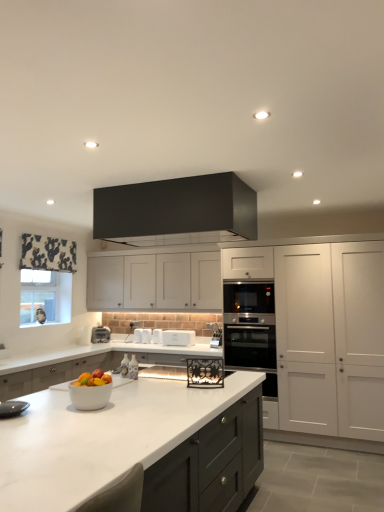
This screenshot has height=512, width=384. What do you see at coordinates (215, 334) in the screenshot? I see `satin black oven at center, which is counted as the fourth appliance, starting from the left` at bounding box center [215, 334].

Describe the element at coordinates (250, 329) in the screenshot. I see `satin silver oven at center, the 1th oven positioned from the bottom` at that location.

Find the location of a particular element. satin silver oven at center, which appears as the second oven when viewed from the top is located at coordinates (250, 329).

What is the approximate width of white plastic toaster at center?

white plastic toaster at center is 11.09 inches in width.

What is the approximate width of white plastic toaster at center, which is the 2th appliance in left-to-right order?

7.11 inches.

Where is `shiny plastic bowl at center`? shiny plastic bowl at center is located at coordinates (93, 379).

Locate an element on the screen. This screenshot has height=512, width=384. satin black oven at center, the 1th appliance in the right-to-left sequence is located at coordinates [x=215, y=334].

Measure the distance from white plastic toaster at center, the 3th appliance when ordered from left to right, to white matte cabinet at center, which ranks as the 3th cabinetry in front-to-back order.

white plastic toaster at center, the 3th appliance when ordered from left to right, and white matte cabinet at center, which ranks as the 3th cabinetry in front-to-back order, are 79.64 centimeters apart from each other.

Based on the photo, from a real-world perspective, which object stands above the other?

white matte cabinet at center, the first cabinetry in the back-to-front sequence, from a real-world perspective.

Looking at this image, is white plastic toaster at center, the 3th appliance when ordered from left to right, placed right next to white matte cabinet at center, which ranks as the 3th cabinetry in front-to-back order?

No, white plastic toaster at center, the 3th appliance when ordered from left to right, is not making contact with white matte cabinet at center, which ranks as the 3th cabinetry in front-to-back order.

Considering the positions of objects white plastic toaster at center, acting as the 2th appliance starting from the right, and white matte cabinet at center, the first cabinetry in the back-to-front sequence, in the image provided, who is more to the right, white plastic toaster at center, acting as the 2th appliance starting from the right, or white matte cabinet at center, the first cabinetry in the back-to-front sequence,?

white plastic toaster at center, acting as the 2th appliance starting from the right.

Considering the sizes of satin black oven at right, which is the 1th oven from top to bottom, and clear glass window screen at left in the image, is satin black oven at right, which is the 1th oven from top to bottom, wider or thinner than clear glass window screen at left?

satin black oven at right, which is the 1th oven from top to bottom, is wider than clear glass window screen at left.

Is satin black oven at right, the 2th oven positioned from the bottom, not within clear glass window screen at left?

Indeed, satin black oven at right, the 2th oven positioned from the bottom, is completely outside clear glass window screen at left.

Between satin black oven at right, which is the 1th oven from top to bottom, and clear glass window screen at left, which one has less height?

satin black oven at right, which is the 1th oven from top to bottom.

From the image's perspective, is satin black oven at right, the 2th oven positioned from the bottom, on clear glass window screen at left?

Indeed, from the image's perspective, satin black oven at right, the 2th oven positioned from the bottom, is shown above clear glass window screen at left.

Can you tell me how much white plastic toaster at center, which is the 3th appliance in right-to-left order, and clear glass window screen at left differ in facing direction?

The facing directions of white plastic toaster at center, which is the 3th appliance in right-to-left order, and clear glass window screen at left are 88.6 degrees apart.

Where is `window screen lying on the left of white plastic toaster at center, which is the 2th appliance in left-to-right order`? This screenshot has width=384, height=512. window screen lying on the left of white plastic toaster at center, which is the 2th appliance in left-to-right order is located at coordinates (45, 297).

Which point is more forward, (148,340) or (46,279)?

The point (46,279) is more forward.

Based on the photo, is clear glass window screen at left completely or partially inside white plastic toaster at center, which is the 2th appliance in left-to-right order?

No, clear glass window screen at left is not a part of white plastic toaster at center, which is the 2th appliance in left-to-right order.

Who is taller, white matte cabinet at center, which ranks as the 3th cabinetry in front-to-back order, or white plastic toaster at center, which is the 2th appliance in left-to-right order?

With more height is white matte cabinet at center, which ranks as the 3th cabinetry in front-to-back order.

From the picture: Is white matte cabinet at center, the first cabinetry in the back-to-front sequence, located outside white plastic toaster at center, which is the 2th appliance in left-to-right order?

Yes, white matte cabinet at center, the first cabinetry in the back-to-front sequence, is outside of white plastic toaster at center, which is the 2th appliance in left-to-right order.

How distant is white matte cabinet at center, which ranks as the 3th cabinetry in front-to-back order, from white plastic toaster at center, which is the 2th appliance in left-to-right order?

They are 75.17 centimeters apart.

Is there a large distance between white matte cabinet at center, the first cabinetry in the back-to-front sequence, and white plastic toaster at center, which is the 2th appliance in left-to-right order?

white matte cabinet at center, the first cabinetry in the back-to-front sequence, is actually quite close to white plastic toaster at center, which is the 2th appliance in left-to-right order.

Can you confirm if satin black oven at center, which is counted as the fourth appliance, starting from the left, is taller than satin black oven at right, the 2th oven positioned from the bottom?

Incorrect, the height of satin black oven at center, which is counted as the fourth appliance, starting from the left, is not larger of that of satin black oven at right, the 2th oven positioned from the bottom.

Is point (221, 338) closer or farther from the camera than point (256, 303)?

Point (221, 338) is farther from the camera than point (256, 303).

Would you consider satin black oven at center, the 1th appliance in the right-to-left sequence, to be distant from satin black oven at right, which is the 1th oven from top to bottom?

No, satin black oven at center, the 1th appliance in the right-to-left sequence, is not far away from satin black oven at right, which is the 1th oven from top to bottom.

Considering the sizes of objects satin black oven at center, the 1th appliance in the right-to-left sequence, and satin black oven at right, which is the 1th oven from top to bottom, in the image provided, who is smaller, satin black oven at center, the 1th appliance in the right-to-left sequence, or satin black oven at right, which is the 1th oven from top to bottom,?

satin black oven at center, the 1th appliance in the right-to-left sequence.

Considering the relative positions of white marble countertop at center and satin black oven at center, the 1th appliance in the right-to-left sequence, in the image provided, is white marble countertop at center to the right of satin black oven at center, the 1th appliance in the right-to-left sequence, from the viewer's perspective?

In fact, white marble countertop at center is to the left of satin black oven at center, the 1th appliance in the right-to-left sequence.

Between white marble countertop at center and satin black oven at center, the 1th appliance in the right-to-left sequence, which one has larger width?

white marble countertop at center is wider.

From the image's perspective, is white marble countertop at center located above satin black oven at center, the 1th appliance in the right-to-left sequence?

Incorrect, from the image's perspective, white marble countertop at center is lower than satin black oven at center, the 1th appliance in the right-to-left sequence.

How different are the orientations of white marble countertop at center and satin black oven at center, which is counted as the fourth appliance, starting from the left, in degrees?

The angle between the facing direction of white marble countertop at center and the facing direction of satin black oven at center, which is counted as the fourth appliance, starting from the left, is 1.15 degrees.

From a real-world perspective, does satin silver oven at center, the 1th oven positioned from the bottom, sit lower than shiny plastic bowl at center?

Correct, in the physical world, satin silver oven at center, the 1th oven positioned from the bottom, is lower than shiny plastic bowl at center.

Would you say satin silver oven at center, which appears as the second oven when viewed from the top, is outside shiny plastic bowl at center?

Yes.

Is satin silver oven at center, the 1th oven positioned from the bottom, looking in the opposite direction of shiny plastic bowl at center?

No, shiny plastic bowl at center is not at the back of satin silver oven at center, the 1th oven positioned from the bottom.

In terms of height, does satin silver oven at center, which appears as the second oven when viewed from the top, look taller or shorter compared to shiny plastic bowl at center?

Considering their sizes, satin silver oven at center, which appears as the second oven when viewed from the top, has more height than shiny plastic bowl at center.

Where is `the 3rd appliance positioned below the white matte cabinet at center, which ranks as the 3th cabinetry in front-to-back order (from the image's perspective)`? The width and height of the screenshot is (384, 512). the 3rd appliance positioned below the white matte cabinet at center, which ranks as the 3th cabinetry in front-to-back order (from the image's perspective) is located at coordinates (157, 336).

Image resolution: width=384 pixels, height=512 pixels. Find the location of `window screen on the left of satin black oven at right, which is the 1th oven from top to bottom`. window screen on the left of satin black oven at right, which is the 1th oven from top to bottom is located at coordinates (45, 297).

From the image, which object appears to be farther from matte black range hood at upper center, which ranks as the third cabinetry in back-to-front order, white plastic toaster at center, the 3th appliance when ordered from left to right, or satin black oven at right, the 2th oven positioned from the bottom?

white plastic toaster at center, the 3th appliance when ordered from left to right.

Considering their positions, is satin silver oven at center, the 1th oven positioned from the bottom, positioned further to white marble countertop at center than satin black oven at center, which is counted as the fourth appliance, starting from the left?

satin black oven at center, which is counted as the fourth appliance, starting from the left, is positioned further to the anchor white marble countertop at center.

Looking at the image, which one is located closer to white matte cabinet at center, the first cabinetry in the back-to-front sequence, white matte toaster at center, which appears as the fourth appliance when viewed from the right, or white plastic toaster at center?

The object closer to white matte cabinet at center, the first cabinetry in the back-to-front sequence, is white plastic toaster at center.

Based on their spatial positions, is satin black oven at center, the 1th appliance in the right-to-left sequence, or white plastic toaster at center, the 3th appliance when ordered from left to right, closer to white matte cabinet at center, which ranks as the 3th cabinetry in front-to-back order?

white plastic toaster at center, the 3th appliance when ordered from left to right.

Looking at the image, which one is located further to white plastic toaster at center, satin silver oven at center, the 1th oven positioned from the bottom, or matte black range hood at upper center, acting as the first cabinetry starting from the front?

The object further to white plastic toaster at center is matte black range hood at upper center, acting as the first cabinetry starting from the front.

Which object lies nearer to the anchor point satin black oven at center, which is counted as the fourth appliance, starting from the left, matte black range hood at upper center, which ranks as the third cabinetry in back-to-front order, or white plastic toaster at center, the 3th appliance when ordered from left to right?

white plastic toaster at center, the 3th appliance when ordered from left to right.

Estimate the real-world distances between objects in this image. Which object is closer to white marble countertop at center, white plastic toaster at center or matte black range hood at upper center, acting as the first cabinetry starting from the front?

matte black range hood at upper center, acting as the first cabinetry starting from the front, is closer to white marble countertop at center.

Based on their spatial positions, is white plastic toaster at center, which is the 2th appliance in left-to-right order, or white matte cabinet at center, which ranks as the 3th cabinetry in front-to-back order, further from white plastic toaster at center, acting as the 2th appliance starting from the right?

white matte cabinet at center, which ranks as the 3th cabinetry in front-to-back order, lies further to white plastic toaster at center, acting as the 2th appliance starting from the right, than the other object.

Where is `kitchen appliance positioned between shiny plastic bowl at center and white plastic toaster at center, the 3th appliance when ordered from left to right, from near to far`? The height and width of the screenshot is (512, 384). kitchen appliance positioned between shiny plastic bowl at center and white plastic toaster at center, the 3th appliance when ordered from left to right, from near to far is located at coordinates (178, 338).

Find the location of `window screen positioned between matte black range hood at upper center, acting as the first cabinetry starting from the front, and white plastic toaster at center, which is the 3th appliance in right-to-left order, from near to far`. window screen positioned between matte black range hood at upper center, acting as the first cabinetry starting from the front, and white plastic toaster at center, which is the 3th appliance in right-to-left order, from near to far is located at coordinates (x=45, y=297).

The image size is (384, 512). I want to click on kitchen appliance between shiny plastic bowl at center and white plastic toaster at center, which is the 2th appliance in left-to-right order, in the front-back direction, so click(x=178, y=338).

You are a GUI agent. You are given a task and a screenshot of the screen. Output one action in this format:
    pyautogui.click(x=<x>, y=<y>)
    Task: Click on the kitchen appliance situated between white matte cabinet at center, which ranks as the 3th cabinetry in front-to-back order, and satin black oven at center, which is counted as the fourth appliance, starting from the left, from left to right
    
    Given the screenshot: What is the action you would take?
    pyautogui.click(x=178, y=338)